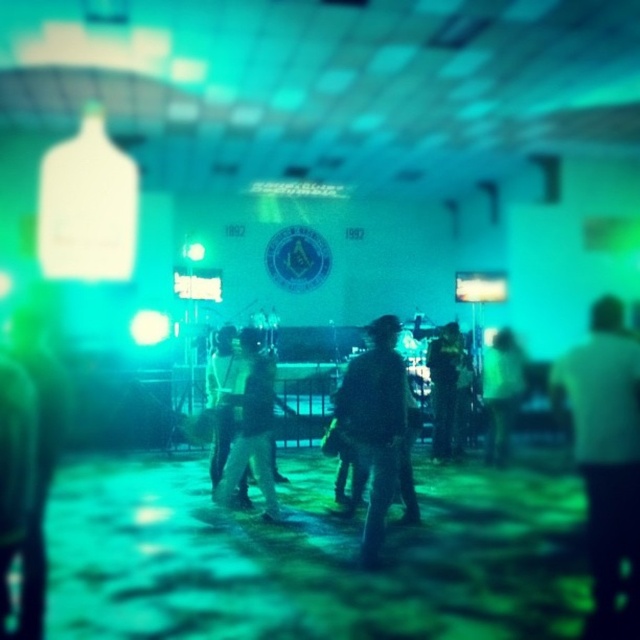
You are organizing a clothing display and need to arrange the dark denim jacket at center and the green fabric jacket at center on a mannequin. Which jacket should you place on top to ensure the smaller one is visible?

The dark denim jacket at center is smaller than the green fabric jacket at center, so place the dark denim jacket at center on top of the green fabric jacket at center to ensure visibility.

In the scene shown: You are organizing a photo shoot and need to place two jackets on a mannequin stand. The dark denim jacket at center and the dark fabric jacket at center are available. If you want to arrange them side by side, which jacket should be placed on the left to ensure they fit within the 1.2 meters width of the stand?

The dark fabric jacket at center should be placed on the left since it is narrower than the dark denim jacket at center. This arrangement ensures both jackets fit within the 1.2 meters width of the stand.

You are organizing a charity event and need to display two jackets on a mannequin. The jackets are the dark denim jacket at center and the dark fabric jacket at center. Which jacket should you choose if you want the one that takes up more space on the mannequin?

The dark fabric jacket at center should be chosen because it occupies more space than the dark denim jacket at center according to the description.